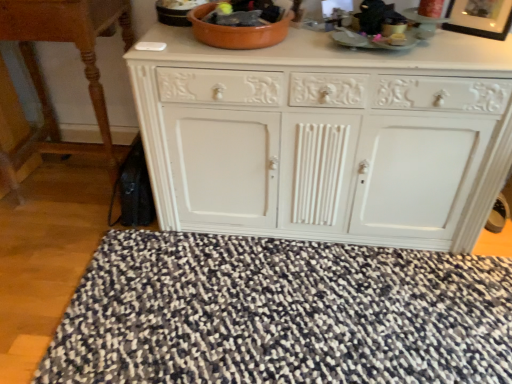
Where is `vacant area that is in front of white painted wood cabinet at center`? This screenshot has width=512, height=384. vacant area that is in front of white painted wood cabinet at center is located at coordinates (320, 309).